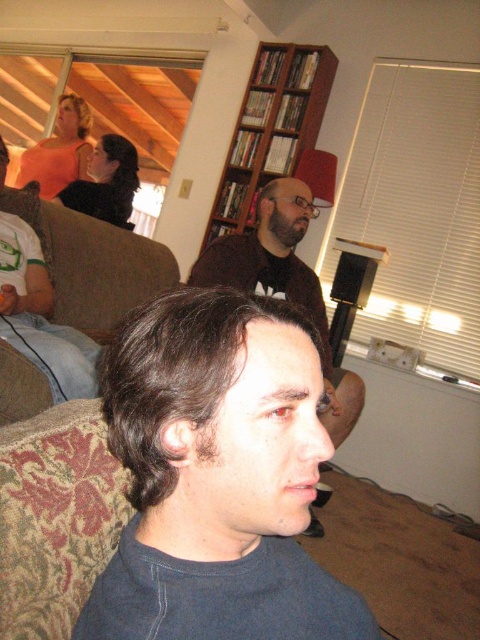
Does dark blue cotton shirt at center have a lesser height compared to brown wooden bookshelf at upper center?

Indeed, dark blue cotton shirt at center has a lesser height compared to brown wooden bookshelf at upper center.

How far apart are dark blue cotton shirt at center and brown wooden bookshelf at upper center?

3.05 meters

Measure the distance between dark blue cotton shirt at center and camera.

dark blue cotton shirt at center is 15.76 inches from camera.

Where is `dark blue cotton shirt at center`? dark blue cotton shirt at center is located at coordinates (216, 476).

Between point (288, 129) and point (302, 300), which one is positioned behind?

Point (288, 129)

Where is `brown wooden bookshelf at upper center`? The width and height of the screenshot is (480, 640). brown wooden bookshelf at upper center is located at coordinates (272, 128).

Does point (272, 100) come closer to viewer compared to point (305, 186)?

That is False.

This screenshot has height=640, width=480. In order to click on brown wooden bookshelf at upper center in this screenshot , I will do `click(272, 128)`.

Does dark blue cotton shirt at center appear under dark brown hair at center?

Yes.

Is dark blue cotton shirt at center shorter than dark brown hair at center?

Correct, dark blue cotton shirt at center is not as tall as dark brown hair at center.

Between point (242, 426) and point (265, 269), which one is positioned behind?

The point (265, 269) is more distant.

Identify the location of dark blue cotton shirt at center. The image size is (480, 640). (216, 476).